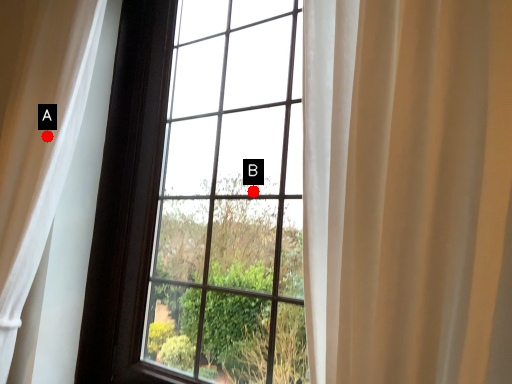
Question: Two points are circled on the image, labeled by A and B beside each circle. Which point is further to the camera?

Choices:
 (A) A is further
 (B) B is further

Answer: (A)